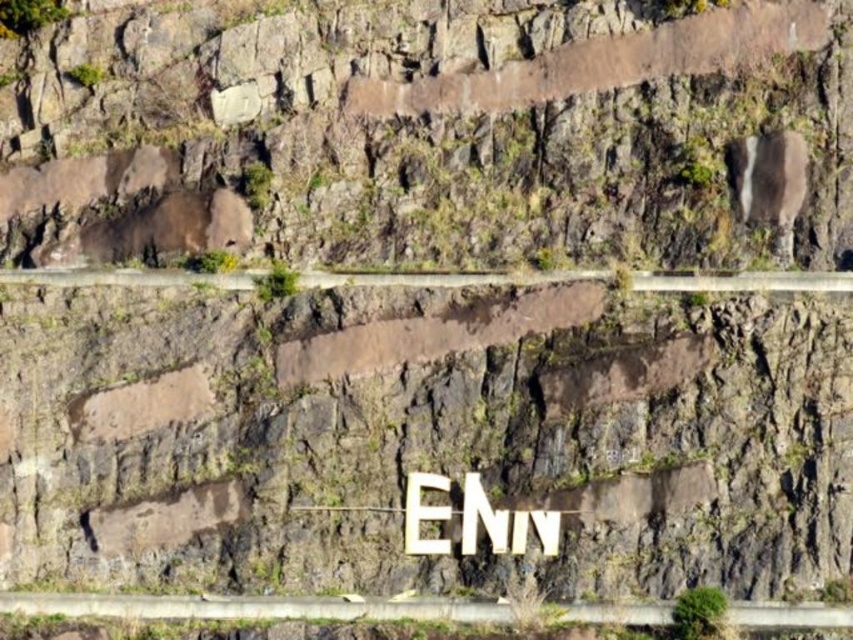
You are a hiker who has just arrived at the cliff area. You see the gray concrete path at lower center and the white wooden sign at center. According to the scene, which object is positioned to the left of the other?

The gray concrete path at lower center is to the left of the white wooden sign at center.

From the picture: You are a hiker who has spotted two landmarks on the cliff face. The first is a brown rock at center, and the second is a white wooden sign at center. From your vantage point, which of these two landmarks is positioned more to the left?

The brown rock at center is positioned more to the left than the white wooden sign at center.

You are a geologist examining the cliff face and notice the brown rock at center. Based on its coordinates, can you determine its exact location on the cliff?

The brown rock at center is located at coordinates point (433, 134).